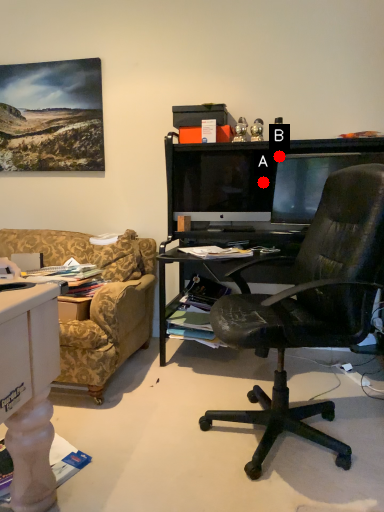
Question: Two points are circled on the image, labeled by A and B beside each circle. Which point is closer to the camera taking this photo?

Choices:
 (A) A is closer
 (B) B is closer

Answer: (B)